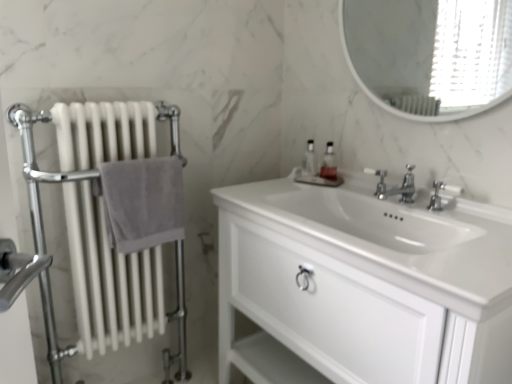
Identify the location of vacant area that is in front of chrome metallic faucet at center, arranged as the second tap when viewed from the right. (440, 220).